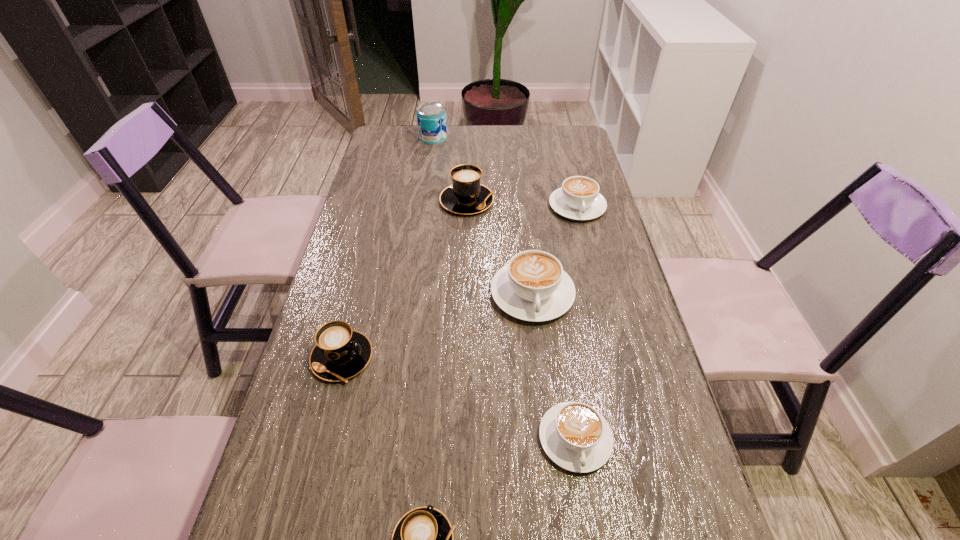
You are a GUI agent. You are given a task and a screenshot of the screen. Output one action in this format:
    pyautogui.click(x=<x>, y=<y>)
    Task: Click on the free point at the far edge
    
    Given the screenshot: What is the action you would take?
    pyautogui.click(x=532, y=125)

In the image, there is a desktop. What are the coordinates of `blank space at the left edge` in the screenshot? It's located at (372, 367).

The width and height of the screenshot is (960, 540). I want to click on vacant space at the right edge of the desktop, so click(632, 291).

This screenshot has height=540, width=960. In order to click on free space at the far right corner of the desktop in this screenshot , I will do `click(560, 136)`.

Where is `empty space between the third farthest cappuccino and the farthest white cappuccino`? Image resolution: width=960 pixels, height=540 pixels. empty space between the third farthest cappuccino and the farthest white cappuccino is located at coordinates (555, 250).

Find the location of `empty space between the leftmost black cappuccino and the second smallest white cappuccino`. empty space between the leftmost black cappuccino and the second smallest white cappuccino is located at coordinates (460, 282).

This screenshot has width=960, height=540. In order to click on free space between the farthest white cappuccino and the smallest white cappuccino in this screenshot , I will do `click(576, 322)`.

Where is `vacant point located between the farthest white cappuccino and the blue can`? The image size is (960, 540). vacant point located between the farthest white cappuccino and the blue can is located at coordinates (505, 172).

Where is `vacant area that lies between the leftmost cappuccino and the biggest white cappuccino`? Image resolution: width=960 pixels, height=540 pixels. vacant area that lies between the leftmost cappuccino and the biggest white cappuccino is located at coordinates (x=437, y=326).

Where is `object that is the second closest one to the nearest cappuccino`? This screenshot has height=540, width=960. object that is the second closest one to the nearest cappuccino is located at coordinates [340, 353].